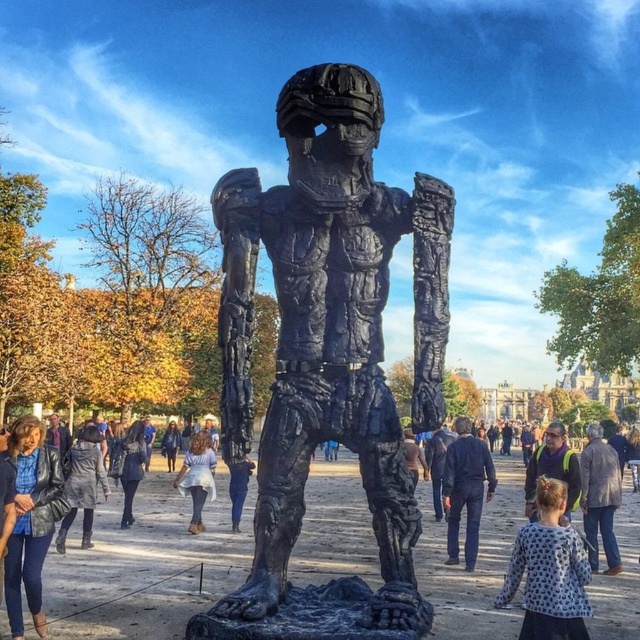
Is the position of dark brown leather jacket at lower right more distant than that of light blue denim skirt at center?

No, it is in front of light blue denim skirt at center.

Does dark brown leather jacket at lower right have a lesser height compared to light blue denim skirt at center?

No.

Find the location of a particular element. dark brown leather jacket at lower right is located at coordinates (600, 497).

Between dark blue jeans at center and dark brown leather jacket at lower right, which one has less height?

With less height is dark brown leather jacket at lower right.

Can you confirm if dark blue jeans at center is wider than dark brown leather jacket at lower right?

Incorrect, dark blue jeans at center's width does not surpass dark brown leather jacket at lower right's.

Does point (452, 442) lie behind point (611, 488)?

That is True.

You are a GUI agent. You are given a task and a screenshot of the screen. Output one action in this format:
    pyautogui.click(x=<x>, y=<y>)
    Task: Click on the dark blue jeans at center
    The image size is (640, 640).
    Given the screenshot: What is the action you would take?
    pyautogui.click(x=465, y=490)

Who is positioned more to the right, white dotted shirt at lower right or denim jacket at center?

white dotted shirt at lower right

Who is positioned more to the left, white dotted shirt at lower right or denim jacket at center?

Positioned to the left is denim jacket at center.

Does point (552, 588) come farther from viewer compared to point (170, 438)?

No, (552, 588) is closer to viewer.

The image size is (640, 640). I want to click on white dotted shirt at lower right, so click(548, 570).